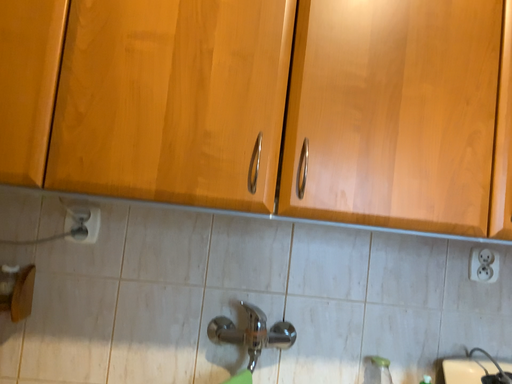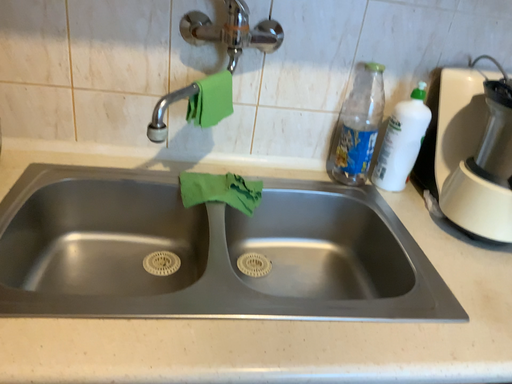
Question: How did the camera likely rotate when shooting the video?

Choices:
 (A) rotated upward
 (B) rotated downward

Answer: (B)